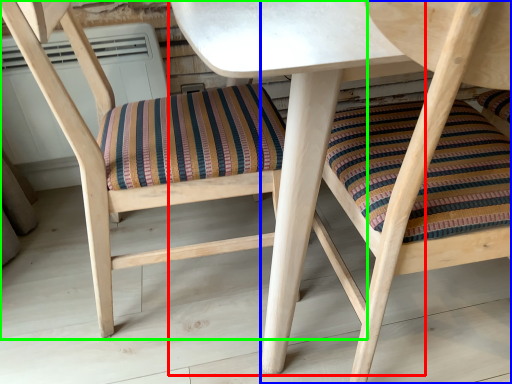
Question: Which object is positioned closest to table (highlighted by a red box)? Select from chair (highlighted by a blue box) and chair (highlighted by a green box).

Choices:
 (A) chair
 (B) chair

Answer: (A)